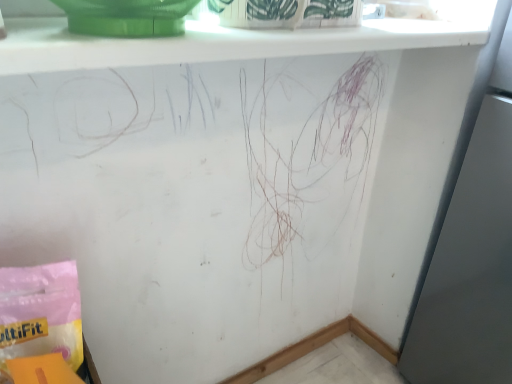
This screenshot has width=512, height=384. What do you see at coordinates (216, 43) in the screenshot? I see `white glossy window sill at upper center` at bounding box center [216, 43].

Locate an element on the screen. The height and width of the screenshot is (384, 512). white glossy window sill at upper center is located at coordinates (216, 43).

In order to face pink paper bag at lower left, should I rotate leftwards or rightwards?

To face it directly, rotate left by 29.691 degrees.

At what (x,y) coordinates should I click in order to perform the action: click on pink paper bag at lower left. Please return your answer as a coordinate pair (x, y). Looking at the image, I should click on (40, 313).

Describe the element at coordinates (40, 313) in the screenshot. The height and width of the screenshot is (384, 512). I see `pink paper bag at lower left` at that location.

Where is `white glossy window sill at upper center`? The height and width of the screenshot is (384, 512). white glossy window sill at upper center is located at coordinates (216, 43).

Which object is positioned more to the left, pink paper bag at lower left or white glossy window sill at upper center?

From the viewer's perspective, pink paper bag at lower left appears more on the left side.

Which is in front, pink paper bag at lower left or white glossy window sill at upper center?

white glossy window sill at upper center is closer to the camera.

Is point (26, 351) farther from camera compared to point (129, 60)?

Yes, it is behind point (129, 60).

From the image's perspective, is pink paper bag at lower left located beneath white glossy window sill at upper center?

Yes, from the image's perspective, pink paper bag at lower left is below white glossy window sill at upper center.

From a real-world perspective, which is physically above, pink paper bag at lower left or white glossy window sill at upper center?

From a 3D spatial view, white glossy window sill at upper center is above.

Which of these two, pink paper bag at lower left or white glossy window sill at upper center, is wider?

With larger width is white glossy window sill at upper center.

Which of these two, pink paper bag at lower left or white glossy window sill at upper center, stands taller?

pink paper bag at lower left.

Is pink paper bag at lower left bigger or smaller than white glossy window sill at upper center?

Considering their sizes, pink paper bag at lower left takes up less space than white glossy window sill at upper center.

Would you say pink paper bag at lower left is outside white glossy window sill at upper center?

Yes, pink paper bag at lower left is not within white glossy window sill at upper center.

Are pink paper bag at lower left and white glossy window sill at upper center located far from each other?

pink paper bag at lower left is near white glossy window sill at upper center, not far away.

Could you tell me if pink paper bag at lower left is facing white glossy window sill at upper center?

No.

The width and height of the screenshot is (512, 384). I want to click on window sill in front of the pink paper bag at lower left, so click(x=216, y=43).

Which is more to the right, white glossy window sill at upper center or pink paper bag at lower left?

white glossy window sill at upper center is more to the right.

In the image, is white glossy window sill at upper center positioned in front of or behind pink paper bag at lower left?

Clearly, white glossy window sill at upper center is in front of pink paper bag at lower left.

Is point (63, 54) closer or farther from the camera than point (77, 294)?

Point (63, 54) is closer to the camera than point (77, 294).

From the image's perspective, between white glossy window sill at upper center and pink paper bag at lower left, who is located below?

pink paper bag at lower left is shown below in the image.

From a real-world perspective, which object stands above the other?

From a 3D spatial view, white glossy window sill at upper center is above.

Considering the sizes of objects white glossy window sill at upper center and pink paper bag at lower left in the image provided, who is wider, white glossy window sill at upper center or pink paper bag at lower left?

white glossy window sill at upper center is wider.

Considering the sizes of objects white glossy window sill at upper center and pink paper bag at lower left in the image provided, who is taller, white glossy window sill at upper center or pink paper bag at lower left?

Standing taller between the two is pink paper bag at lower left.

Between white glossy window sill at upper center and pink paper bag at lower left, which one has smaller size?

With smaller size is pink paper bag at lower left.

Consider the image. Would you say white glossy window sill at upper center is outside pink paper bag at lower left?

Absolutely, white glossy window sill at upper center is external to pink paper bag at lower left.

Is white glossy window sill at upper center in contact with pink paper bag at lower left?

No.

Is white glossy window sill at upper center oriented away from pink paper bag at lower left?

No.

How many degrees apart are the facing directions of white glossy window sill at upper center and pink paper bag at lower left?

0.472 degrees.

How distant is white glossy window sill at upper center from pink paper bag at lower left?

41.75 centimeters.

Locate an element on the screen. material below the white glossy window sill at upper center (from the image's perspective) is located at coordinates (40, 313).

I want to click on window sill that is on the right side of pink paper bag at lower left, so click(x=216, y=43).

Where is `material lying behind the white glossy window sill at upper center`? material lying behind the white glossy window sill at upper center is located at coordinates (40, 313).